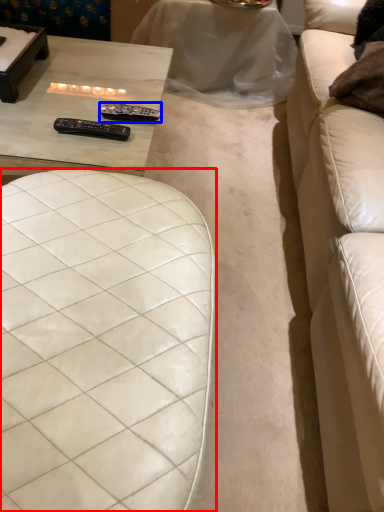
Question: Which of the following is the closest to the observer, furniture (highlighted by a red box) or remote (highlighted by a blue box)?

Choices:
 (A) furniture
 (B) remote

Answer: (A)